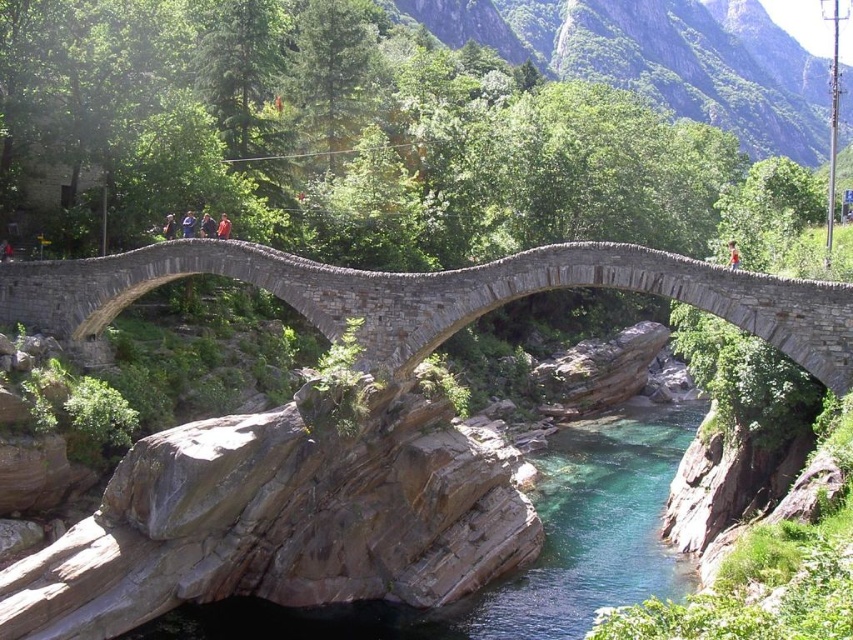
Question: Is blue denim jacket at upper center further to the viewer compared to orange fabric person at center?

Choices:
 (A) yes
 (B) no

Answer: (A)

Question: Which object appears farthest from the camera in this image?

Choices:
 (A) dark blue fabric jacket at center
 (B) orange fabric person at center
 (C) blue denim jacket at upper center

Answer: (A)

Question: Does clear stone river at center come behind blue denim jacket at upper center?

Choices:
 (A) yes
 (B) no

Answer: (B)

Question: Which point appears closest to the camera in this image?

Choices:
 (A) (225, 224)
 (B) (202, 224)
 (C) (737, 252)
 (D) (167, 228)

Answer: (C)

Question: Based on their relative distances, which object is farther from the orange fabric person at center?

Choices:
 (A) dark blue shirt at center
 (B) dark blue fabric jacket at center

Answer: (B)

Question: Can you confirm if blue denim jacket at upper center is positioned to the left of orange fabric person at center?

Choices:
 (A) yes
 (B) no

Answer: (A)